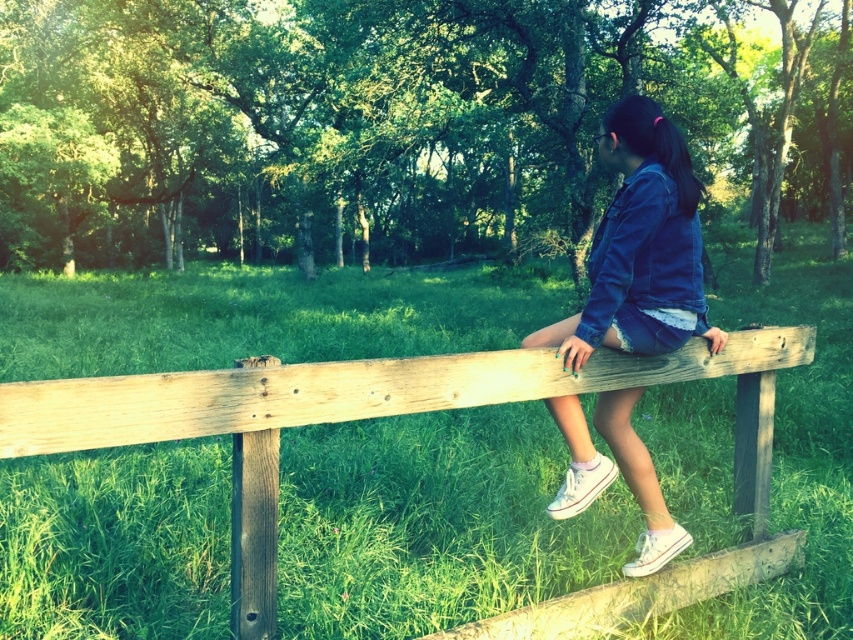
Does wooden fence at center lie in front of denim jacket at center?

Yes, it is.

Is wooden fence at center shorter than denim jacket at center?

Indeed, wooden fence at center has a lesser height compared to denim jacket at center.

Does point (567, 611) come farther from viewer compared to point (630, 308)?

Yes, it is.

Find the location of a particular element. Image resolution: width=853 pixels, height=640 pixels. wooden fence at center is located at coordinates (419, 412).